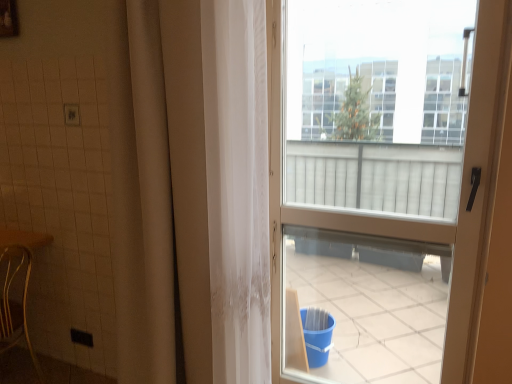
Question: Is point (482, 187) closer or farther from the camera than point (12, 344)?

Choices:
 (A) closer
 (B) farther

Answer: (A)

Question: Is matte plastic door at upper right taller or shorter than wooden chair at lower left?

Choices:
 (A) tall
 (B) short

Answer: (A)

Question: Considering the positions of matte plastic door at upper right and wooden chair at lower left in the image, is matte plastic door at upper right bigger or smaller than wooden chair at lower left?

Choices:
 (A) big
 (B) small

Answer: (A)

Question: Would you say wooden chair at lower left is to the left or to the right of matte plastic door at upper right in the picture?

Choices:
 (A) left
 (B) right

Answer: (A)

Question: Is wooden chair at lower left inside or outside of matte plastic door at upper right?

Choices:
 (A) outside
 (B) inside

Answer: (A)

Question: Is point (9, 248) closer or farther from the camera than point (432, 365)?

Choices:
 (A) closer
 (B) farther

Answer: (A)

Question: Looking at their shapes, would you say wooden chair at lower left is wider or thinner than matte plastic door at upper right?

Choices:
 (A) wide
 (B) thin

Answer: (A)